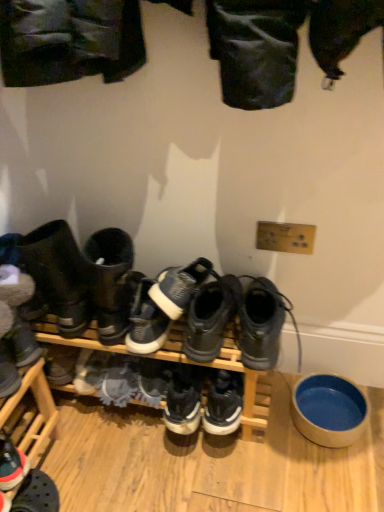
Measure the distance between white suede sneaker at center, placed as the 4th footwear when sorted from left to right, and camera.

The depth of white suede sneaker at center, placed as the 4th footwear when sorted from left to right, is 98.85 centimeters.

Describe the element at coordinates (119, 381) in the screenshot. I see `suede gray shoe at center, marked as the first shoe in a left-to-right arrangement` at that location.

Where is `reddish-brown leather sneaker at lower left, which is the 1th footwear in left-to-right order`? The image size is (384, 512). reddish-brown leather sneaker at lower left, which is the 1th footwear in left-to-right order is located at coordinates (11, 465).

Image resolution: width=384 pixels, height=512 pixels. In order to click on white suede sneaker at center, placed as the 4th footwear when sorted from left to right in this screenshot , I will do `click(147, 321)`.

From a real-world perspective, is black mesh sneakers at center, the 2th footwear from the right, positioned above or below white suede sneaker at lower left, which is the 4th footwear from right to left?

black mesh sneakers at center, the 2th footwear from the right, is above white suede sneaker at lower left, which is the 4th footwear from right to left.

Which footwear is the 2nd one when counting from the left side of the black mesh sneakers at center, the 2th footwear from the right? Please provide its 2D coordinates.

[(90, 371)]

Which object is more forward, black mesh sneakers at center, acting as the 5th footwear starting from the left, or white suede sneaker at lower left, which appears as the third footwear when viewed from the left?

black mesh sneakers at center, acting as the 5th footwear starting from the left, is more forward.

Looking at their sizes, would you say black mesh sneakers at center, the 2th footwear from the right, is wider or thinner than white suede sneaker at lower left, which is the 4th footwear from right to left?

Considering their sizes, black mesh sneakers at center, the 2th footwear from the right, looks broader than white suede sneaker at lower left, which is the 4th footwear from right to left.

From a real-world perspective, which is physically below, leather boots at left, the 2th footwear when ordered from left to right, or white suede shoe at center, arranged as the second shoe when viewed from the left?

white suede shoe at center, arranged as the second shoe when viewed from the left, is physically lower.

Is leather boots at left, the 2th footwear when ordered from left to right, oriented towards white suede shoe at center, the first shoe viewed from the right?

No, leather boots at left, the 2th footwear when ordered from left to right, is not facing towards white suede shoe at center, the first shoe viewed from the right.

I want to click on the 2nd shoe behind the leather boots at left, which appears as the fifth footwear when viewed from the right, counting from the anchor's position, so click(153, 381).

Which of these two, leather boots at left, which appears as the fifth footwear when viewed from the right, or white suede shoe at center, the first shoe viewed from the right, stands taller?

With more height is leather boots at left, which appears as the fifth footwear when viewed from the right.

Is white suede sneaker at center, placed as the 4th footwear when sorted from left to right, closer to the viewer compared to leather boots at left, the 2th footwear when ordered from left to right?

That is False.

Which footwear is the 1st one when counting from the back of the leather boots at left, the 2th footwear when ordered from left to right? Please provide its 2D coordinates.

[(147, 321)]

From the image's perspective, is white suede sneaker at center, the 3th footwear in the right-to-left sequence, located above leather boots at left, the 2th footwear when ordered from left to right?

Actually, white suede sneaker at center, the 3th footwear in the right-to-left sequence, appears below leather boots at left, the 2th footwear when ordered from left to right, in the image.

Considering the relative sizes of suede gray shoe at center, positioned as the 2th shoe in right-to-left order, and white suede sneaker at lower left, which is the 4th footwear from right to left, in the image provided, is suede gray shoe at center, positioned as the 2th shoe in right-to-left order, wider than white suede sneaker at lower left, which is the 4th footwear from right to left,?

Yes.

From a real-world perspective, is suede gray shoe at center, positioned as the 2th shoe in right-to-left order, located higher than white suede sneaker at lower left, which appears as the third footwear when viewed from the left?

Indeed, from a real-world perspective, suede gray shoe at center, positioned as the 2th shoe in right-to-left order, stands above white suede sneaker at lower left, which appears as the third footwear when viewed from the left.

You are a GUI agent. You are given a task and a screenshot of the screen. Output one action in this format:
    pyautogui.click(x=<x>, y=<y>)
    Task: Click on the 2nd shoe in front of the white suede sneaker at lower left, which appears as the third footwear when viewed from the left, starting your count from the anchor
    The height and width of the screenshot is (512, 384).
    Given the screenshot: What is the action you would take?
    pyautogui.click(x=119, y=381)

Does suede gray shoe at center, marked as the first shoe in a left-to-right arrangement, turn towards white suede sneaker at lower left, which is the 4th footwear from right to left?

No.

From a real-world perspective, is leather boots at left, which appears as the fifth footwear when viewed from the right, above or below blue ceramic bowl at lower right?

In terms of real-world spatial position, leather boots at left, which appears as the fifth footwear when viewed from the right, is above blue ceramic bowl at lower right.

Is blue ceramic bowl at lower right completely or partially inside leather boots at left, the 2th footwear when ordered from left to right?

No, blue ceramic bowl at lower right is not a part of leather boots at left, the 2th footwear when ordered from left to right.

Could you tell me if leather boots at left, which appears as the fifth footwear when viewed from the right, is turned towards blue ceramic bowl at lower right?

No, leather boots at left, which appears as the fifth footwear when viewed from the right, is not facing towards blue ceramic bowl at lower right.

Based on the photo, are leather boots at left, the 2th footwear when ordered from left to right, and blue ceramic bowl at lower right far apart?

leather boots at left, the 2th footwear when ordered from left to right, is near blue ceramic bowl at lower right, not far away.

Consider the image. Is white suede shoe at center, arranged as the second shoe when viewed from the left, further to the viewer compared to reddish-brown leather sneaker at lower left, which is the 1th footwear in left-to-right order?

Yes, white suede shoe at center, arranged as the second shoe when viewed from the left, is behind reddish-brown leather sneaker at lower left, which is the 1th footwear in left-to-right order.

Is white suede shoe at center, the first shoe viewed from the right, oriented towards reddish-brown leather sneaker at lower left, which is the 1th footwear in left-to-right order?

No.

Consider the image. Can you confirm if white suede shoe at center, the first shoe viewed from the right, is positioned to the left of reddish-brown leather sneaker at lower left, marked as the sixth footwear in a right-to-left arrangement?

In fact, white suede shoe at center, the first shoe viewed from the right, is to the right of reddish-brown leather sneaker at lower left, marked as the sixth footwear in a right-to-left arrangement.

Is white suede shoe at center, arranged as the second shoe when viewed from the left, not near reddish-brown leather sneaker at lower left, marked as the sixth footwear in a right-to-left arrangement?

No, white suede shoe at center, arranged as the second shoe when viewed from the left, is not far away from reddish-brown leather sneaker at lower left, marked as the sixth footwear in a right-to-left arrangement.

Can you confirm if leather boots at left, which appears as the fifth footwear when viewed from the right, is positioned to the left of reddish-brown leather sneaker at lower left, which is the 1th footwear in left-to-right order?

No.

Looking at this image, is leather boots at left, the 2th footwear when ordered from left to right, far away from reddish-brown leather sneaker at lower left, marked as the sixth footwear in a right-to-left arrangement?

No, leather boots at left, the 2th footwear when ordered from left to right, is not far away from reddish-brown leather sneaker at lower left, marked as the sixth footwear in a right-to-left arrangement.

Consider the image. From the image's perspective, is leather boots at left, the 2th footwear when ordered from left to right, positioned above or below reddish-brown leather sneaker at lower left, marked as the sixth footwear in a right-to-left arrangement?

Based on their image positions, leather boots at left, the 2th footwear when ordered from left to right, is located above reddish-brown leather sneaker at lower left, marked as the sixth footwear in a right-to-left arrangement.

Is point (63, 316) positioned behind point (10, 465)?

Yes.

Locate an element on the screen. the 4th footwear in front when counting from the white suede sneaker at lower left, which is the 4th footwear from right to left is located at coordinates (210, 318).

From a real-world perspective, count 2nd shoes downward from the leather boots at left, which appears as the fifth footwear when viewed from the right, and point to it. Please provide its 2D coordinates.

[(153, 381)]

Looking at the image, which one is located closer to suede gray shoe at center, positioned as the 2th shoe in right-to-left order, white suede sneaker at center, the 3th footwear in the right-to-left sequence, or black mesh sneakers at center, the 2th footwear from the right?

white suede sneaker at center, the 3th footwear in the right-to-left sequence, is positioned closer to the anchor suede gray shoe at center, positioned as the 2th shoe in right-to-left order.

When comparing their distances from reddish-brown leather sneaker at lower left, which is the 1th footwear in left-to-right order, does gray suede boot at center, the sixth footwear positioned from the left, or leather boots at left, the 2th footwear when ordered from left to right, seem further?

gray suede boot at center, the sixth footwear positioned from the left, lies further to reddish-brown leather sneaker at lower left, which is the 1th footwear in left-to-right order, than the other object.

Considering their positions, is white suede shoe at center, the first shoe viewed from the right, positioned further to reddish-brown leather sneaker at lower left, marked as the sixth footwear in a right-to-left arrangement, than blue ceramic bowl at lower right?

The object further to reddish-brown leather sneaker at lower left, marked as the sixth footwear in a right-to-left arrangement, is blue ceramic bowl at lower right.

From the image, which object appears to be farther from reddish-brown leather sneaker at lower left, which is the 1th footwear in left-to-right order, black mesh sneakers at center, acting as the 5th footwear starting from the left, or white suede shoe at center, the first shoe viewed from the right?

black mesh sneakers at center, acting as the 5th footwear starting from the left, is further to reddish-brown leather sneaker at lower left, which is the 1th footwear in left-to-right order.

Considering their positions, is gray suede boot at center, the sixth footwear positioned from the left, positioned closer to blue ceramic bowl at lower right than white suede sneaker at lower left, which appears as the third footwear when viewed from the left?

Based on the image, gray suede boot at center, the sixth footwear positioned from the left, appears to be nearer to blue ceramic bowl at lower right.

Looking at the image, which one is located closer to blue ceramic bowl at lower right, black mesh sneakers at center, the 2th footwear from the right, or white suede shoe at center, arranged as the second shoe when viewed from the left?

The object closer to blue ceramic bowl at lower right is black mesh sneakers at center, the 2th footwear from the right.

Estimate the real-world distances between objects in this image. Which object is further from white suede shoe at center, arranged as the second shoe when viewed from the left, reddish-brown leather sneaker at lower left, marked as the sixth footwear in a right-to-left arrangement, or white suede sneaker at center, the 3th footwear in the right-to-left sequence?

The object further to white suede shoe at center, arranged as the second shoe when viewed from the left, is reddish-brown leather sneaker at lower left, marked as the sixth footwear in a right-to-left arrangement.

When comparing their distances from suede gray shoe at center, marked as the first shoe in a left-to-right arrangement, does white suede sneaker at center, the 3th footwear in the right-to-left sequence, or gray suede boot at center, the sixth footwear positioned from the left, seem closer?

white suede sneaker at center, the 3th footwear in the right-to-left sequence.

Locate an element on the screen. Image resolution: width=384 pixels, height=512 pixels. footwear located between white suede sneaker at lower left, which appears as the third footwear when viewed from the left, and black mesh sneakers at center, acting as the 5th footwear starting from the left, in the left-right direction is located at coordinates (147, 321).

The image size is (384, 512). I want to click on footwear between suede gray shoe at center, positioned as the 2th shoe in right-to-left order, and black mesh sneakers at center, acting as the 5th footwear starting from the left, in the horizontal direction, so click(147, 321).

In order to click on shoe between leather boots at left, which appears as the fifth footwear when viewed from the right, and white suede shoe at center, arranged as the second shoe when viewed from the left, vertically in this screenshot , I will do `click(119, 381)`.

Identify the location of shoe between suede gray shoe at center, positioned as the 2th shoe in right-to-left order, and gray suede boot at center, the sixth footwear positioned from the left, in the horizontal direction. The width and height of the screenshot is (384, 512). (153, 381).